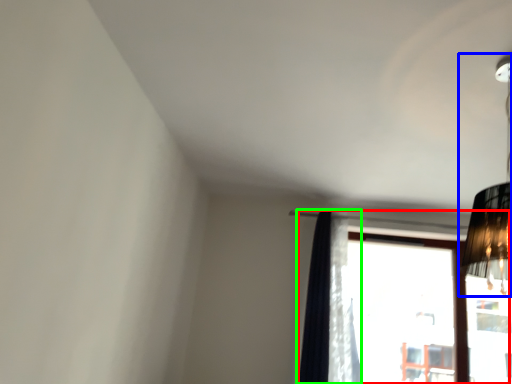
Question: Which object is positioned farthest from window (highlighted by a red box)? Select from lamp (highlighted by a blue box) and curtain (highlighted by a green box).

Choices:
 (A) lamp
 (B) curtain

Answer: (A)